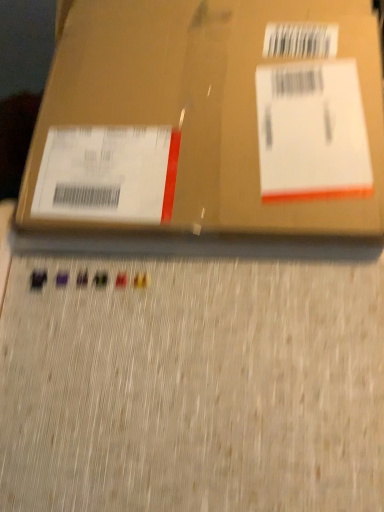
The width and height of the screenshot is (384, 512). What do you see at coordinates (202, 105) in the screenshot?
I see `brown cardboard box at upper center` at bounding box center [202, 105].

Locate an element on the screen. This screenshot has height=512, width=384. brown cardboard box at upper center is located at coordinates (202, 105).

What is the approximate width of brown cardboard box at upper center?

The width of brown cardboard box at upper center is 20.94 inches.

Identify the location of brown cardboard box at upper center. This screenshot has height=512, width=384. (202, 105).